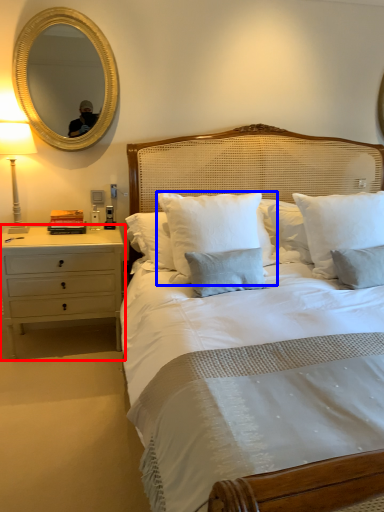
Question: Which of the following is the closest to the observer, nightstand (highlighted by a red box) or pillow (highlighted by a blue box)?

Choices:
 (A) nightstand
 (B) pillow

Answer: (B)